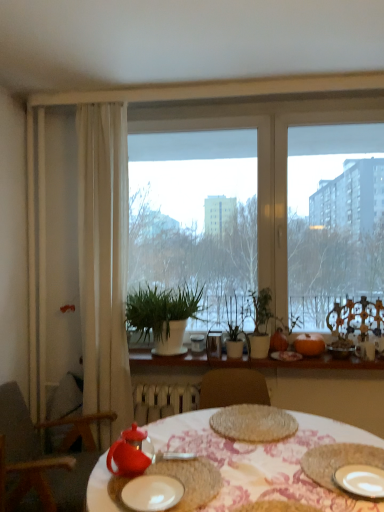
Identify the location of free location above white matte plate at center, the 2th plate viewed from the right (from a real-world perspective). The height and width of the screenshot is (512, 384). (144, 490).